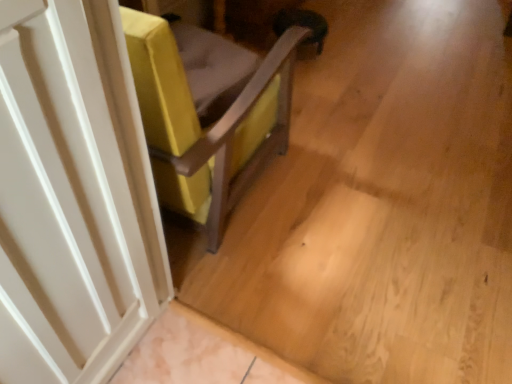
Question: Is velvet yellow chair at center smaller than white matte door at left?

Choices:
 (A) yes
 (B) no

Answer: (B)

Question: From the image's perspective, is velvet yellow chair at center located above white matte door at left?

Choices:
 (A) yes
 (B) no

Answer: (A)

Question: From a real-world perspective, is velvet yellow chair at center located beneath white matte door at left?

Choices:
 (A) no
 (B) yes

Answer: (B)

Question: Considering the relative sizes of velvet yellow chair at center and white matte door at left in the image provided, is velvet yellow chair at center thinner than white matte door at left?

Choices:
 (A) yes
 (B) no

Answer: (B)

Question: Considering the relative sizes of velvet yellow chair at center and white matte door at left in the image provided, is velvet yellow chair at center wider than white matte door at left?

Choices:
 (A) no
 (B) yes

Answer: (B)

Question: Is velvet yellow chair at center aimed at white matte door at left?

Choices:
 (A) no
 (B) yes

Answer: (A)

Question: Is white matte door at left turned away from velvet yellow chair at center?

Choices:
 (A) no
 (B) yes

Answer: (A)

Question: From the image's perspective, is white matte door at left beneath velvet yellow chair at center?

Choices:
 (A) no
 (B) yes

Answer: (B)

Question: Is velvet yellow chair at center surrounded by white matte door at left?

Choices:
 (A) no
 (B) yes

Answer: (A)

Question: Is white matte door at left further to the viewer compared to velvet yellow chair at center?

Choices:
 (A) yes
 (B) no

Answer: (B)

Question: Can you confirm if white matte door at left is wider than velvet yellow chair at center?

Choices:
 (A) yes
 (B) no

Answer: (B)

Question: Does white matte door at left have a larger size compared to velvet yellow chair at center?

Choices:
 (A) no
 (B) yes

Answer: (A)

Question: Considering the positions of point (30, 140) and point (224, 206), is point (30, 140) closer or farther from the camera than point (224, 206)?

Choices:
 (A) farther
 (B) closer

Answer: (B)